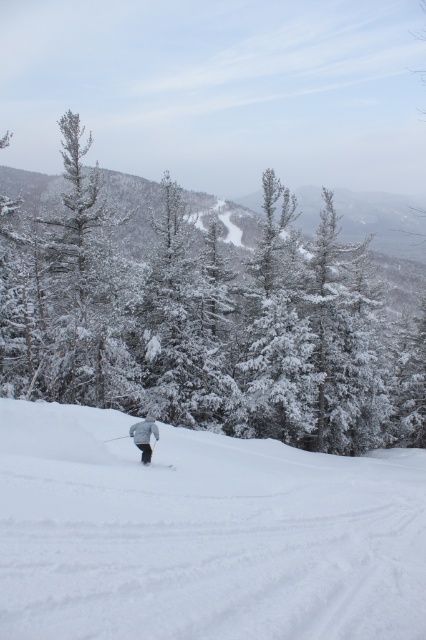
Between gray matte jacket at center and white matte ski at center, which one appears on the left side from the viewer's perspective?

From the viewer's perspective, gray matte jacket at center appears more on the left side.

Is gray matte jacket at center to the left of white matte ski at center from the viewer's perspective?

Indeed, gray matte jacket at center is positioned on the left side of white matte ski at center.

The width and height of the screenshot is (426, 640). Describe the element at coordinates (143, 435) in the screenshot. I see `gray matte jacket at center` at that location.

I want to click on gray matte jacket at center, so click(x=143, y=435).

Which of these two, snow-covered evergreen tree at center or white snow ski slope at center, stands shorter?

Standing shorter between the two is white snow ski slope at center.

Does snow-covered evergreen tree at center come in front of white snow ski slope at center?

No, snow-covered evergreen tree at center is behind white snow ski slope at center.

Is point (62, 356) positioned in front of point (389, 605)?

No, (62, 356) is further to viewer.

Identify the location of snow-covered evergreen tree at center. The height and width of the screenshot is (640, 426). (206, 321).

Who is positioned more to the left, white snow ski slope at center or gray matte jacket at center?

gray matte jacket at center

Which of these two, white snow ski slope at center or gray matte jacket at center, stands shorter?

Standing shorter between the two is gray matte jacket at center.

This screenshot has height=640, width=426. What do you see at coordinates (201, 532) in the screenshot?
I see `white snow ski slope at center` at bounding box center [201, 532].

Locate an element on the screen. The height and width of the screenshot is (640, 426). white snow ski slope at center is located at coordinates (201, 532).